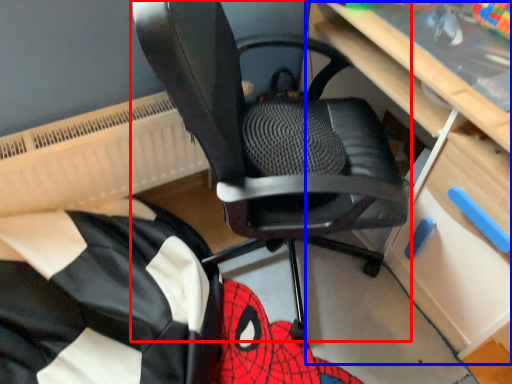
Question: Which object appears closest to the camera in this image, chair (highlighted by a red box) or computer desk (highlighted by a blue box)?

Choices:
 (A) chair
 (B) computer desk

Answer: (A)